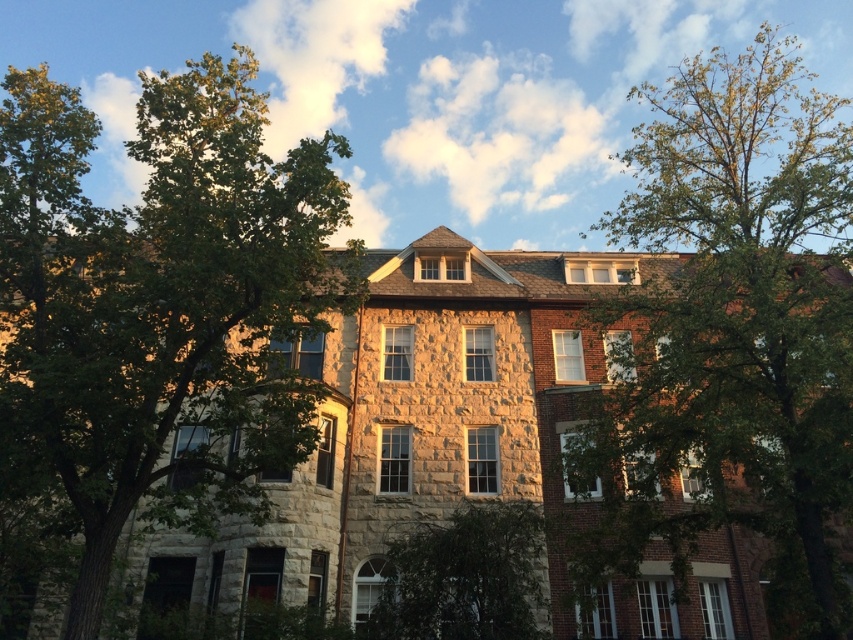
Question: Can you confirm if green leafy tree at right is positioned below green leafy tree at center?

Choices:
 (A) no
 (B) yes

Answer: (A)

Question: Among these objects, which one is nearest to the camera?

Choices:
 (A) green leafy tree at center
 (B) green leafy tree at left

Answer: (B)

Question: Can you confirm if green leafy tree at left is positioned to the right of green leafy tree at right?

Choices:
 (A) no
 (B) yes

Answer: (A)

Question: Which object is the closest to the green leafy tree at right?

Choices:
 (A) green leafy tree at center
 (B) green leafy tree at left

Answer: (A)

Question: Which is nearer to the green leafy tree at right?

Choices:
 (A) green leafy tree at left
 (B) green leafy tree at center

Answer: (B)

Question: Is green leafy tree at right to the left of green leafy tree at center from the viewer's perspective?

Choices:
 (A) yes
 (B) no

Answer: (B)